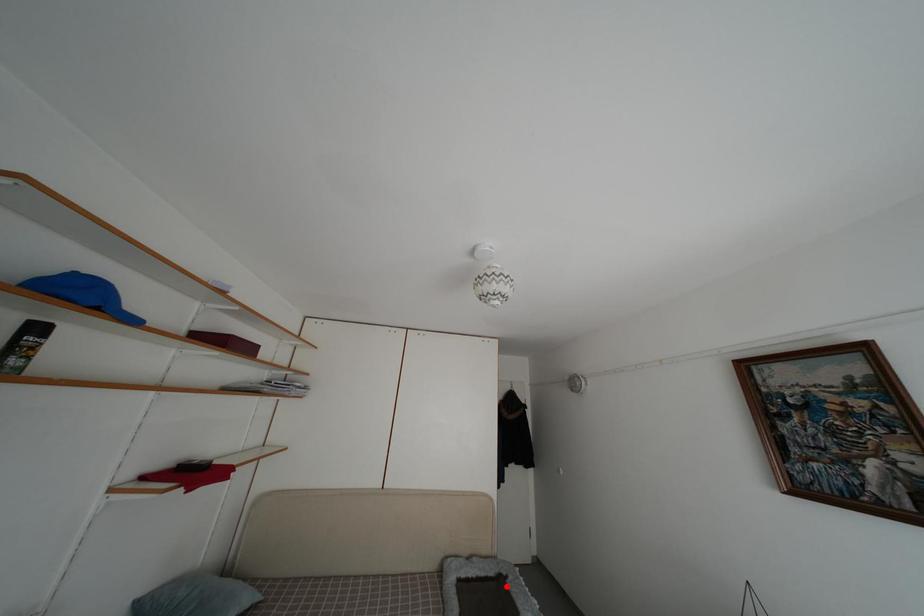
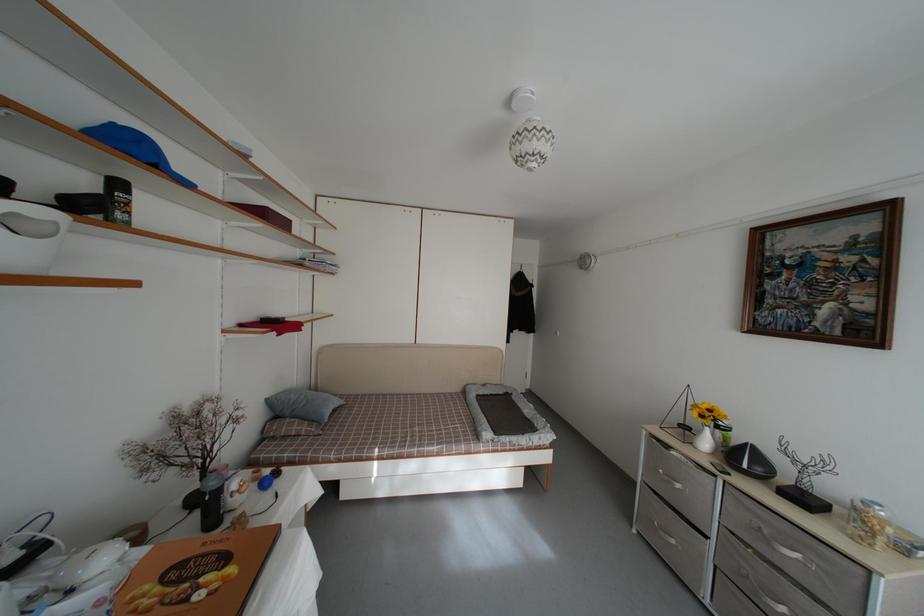
Find the pixel in the second image that matches the highlighted location in the first image.

(513, 402)